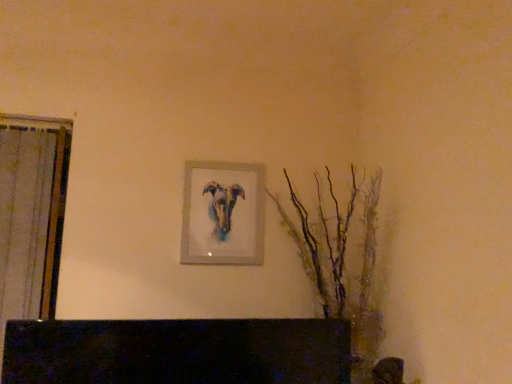
Question: In terms of width, does translucent glass branches at right look wider or thinner when compared to matte silver picture frame at center?

Choices:
 (A) thin
 (B) wide

Answer: (B)

Question: Visually, is translucent glass branches at right positioned to the left or to the right of matte silver picture frame at center?

Choices:
 (A) right
 (B) left

Answer: (A)

Question: Is translucent glass branches at right in front of or behind matte silver picture frame at center in the image?

Choices:
 (A) behind
 (B) front

Answer: (B)

Question: From the image's perspective, relative to translucent glass branches at right, is matte silver picture frame at center above or below?

Choices:
 (A) below
 (B) above

Answer: (B)

Question: Would you say matte silver picture frame at center is inside or outside translucent glass branches at right?

Choices:
 (A) outside
 (B) inside

Answer: (A)

Question: Considering the positions of point (211, 190) and point (342, 309), is point (211, 190) closer or farther from the camera than point (342, 309)?

Choices:
 (A) closer
 (B) farther

Answer: (B)

Question: Looking at their shapes, would you say matte silver picture frame at center is wider or thinner than translucent glass branches at right?

Choices:
 (A) wide
 (B) thin

Answer: (B)